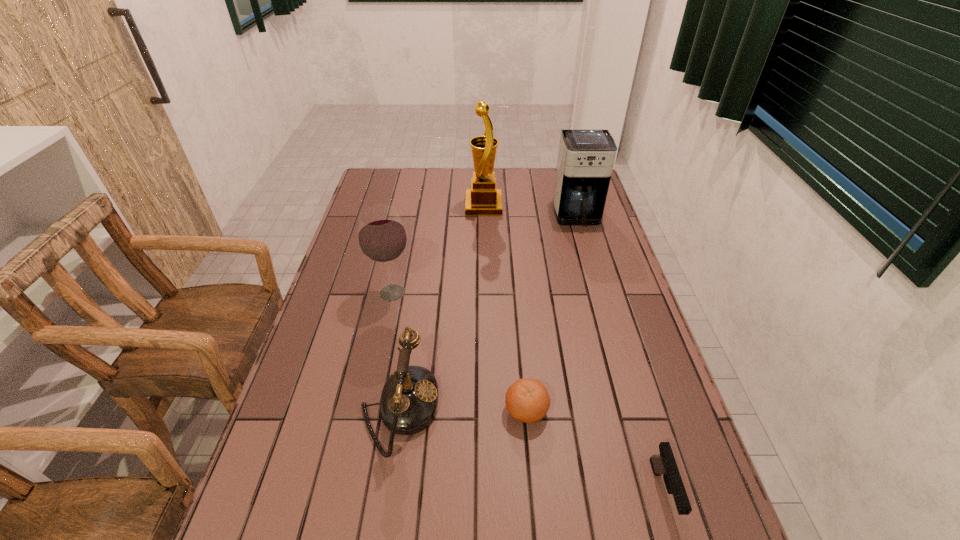
Choose which object is the fourth nearest neighbor to the pistol. Please provide its 2D coordinates. Your answer should be formatted as a tuple, i.e. [(x, y)], where the tuple contains the x and y coordinates of a point satisfying the conditions above.

[(585, 161)]

Identify the location of free spot that satisfies the following two spatial constraints: 1. on the front panel of the coffee maker; 2. on the dial of the telephone. (633, 409).

What are the coordinates of `vacant area that satisfies the following two spatial constraints: 1. on the front side of the alcohol; 2. on the right side of the clementine` in the screenshot? It's located at (368, 410).